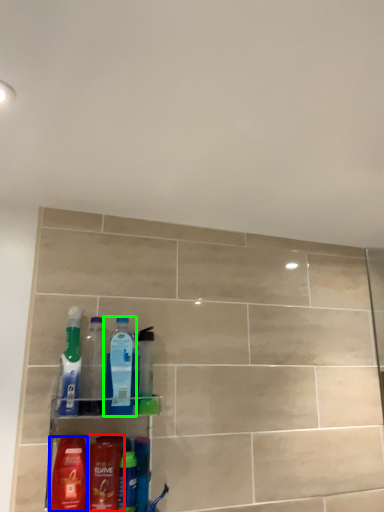
Question: Based on their relative distances, which object is farther from mouthwash (highlighted by a red box)? Choose from cleaning product (highlighted by a blue box) and bottle (highlighted by a green box).

Choices:
 (A) cleaning product
 (B) bottle

Answer: (B)